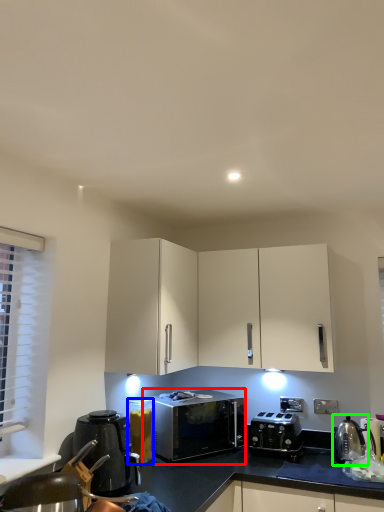
Question: Which is farther away from microwave oven (highlighted by a red box)? appliance (highlighted by a blue box) or appliance (highlighted by a green box)?

Choices:
 (A) appliance
 (B) appliance

Answer: (B)